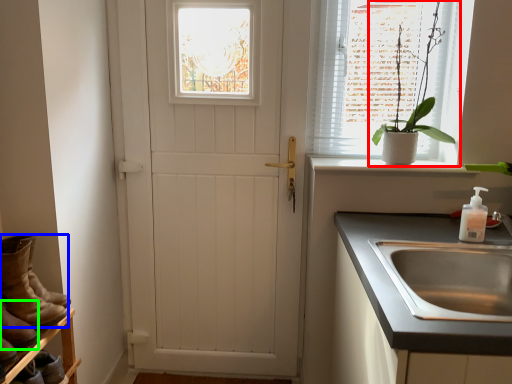
Question: Which object is positioned closest to houseplant (highlighted by a red box)? Select from footwear (highlighted by a blue box) and boot (highlighted by a green box).

Choices:
 (A) footwear
 (B) boot

Answer: (A)